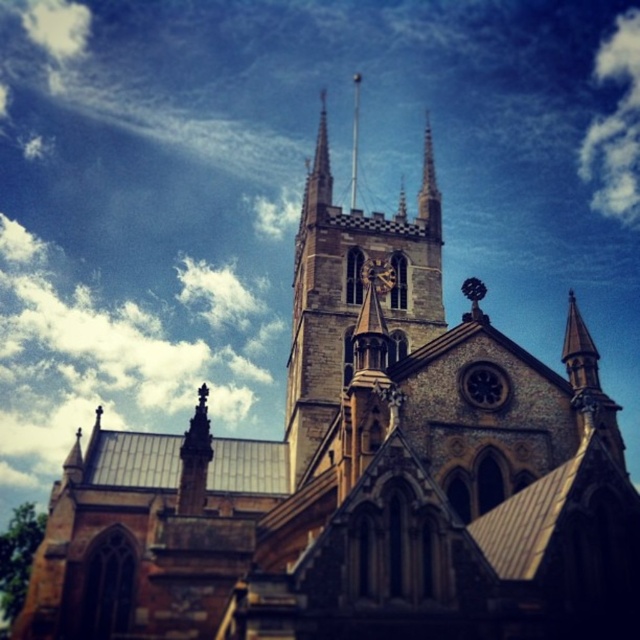
Can you confirm if brown stone clock tower at center is positioned below stone spire at upper center?

Indeed, brown stone clock tower at center is positioned under stone spire at upper center.

Who is more distant from viewer, (339, 259) or (433, 189)?

Positioned behind is point (433, 189).

In order to click on brown stone clock tower at center in this screenshot , I will do `click(349, 310)`.

Locate an element on the screen. The height and width of the screenshot is (640, 640). dark gray stone clock at upper center is located at coordinates (484, 385).

Who is positioned more to the right, brown stone clock tower at center or dark gray stone clock at upper center?

dark gray stone clock at upper center is more to the right.

Is point (301, 449) positioned after point (490, 376)?

Yes, it is behind point (490, 376).

This screenshot has height=640, width=640. Identify the location of brown stone clock tower at center. (349, 310).